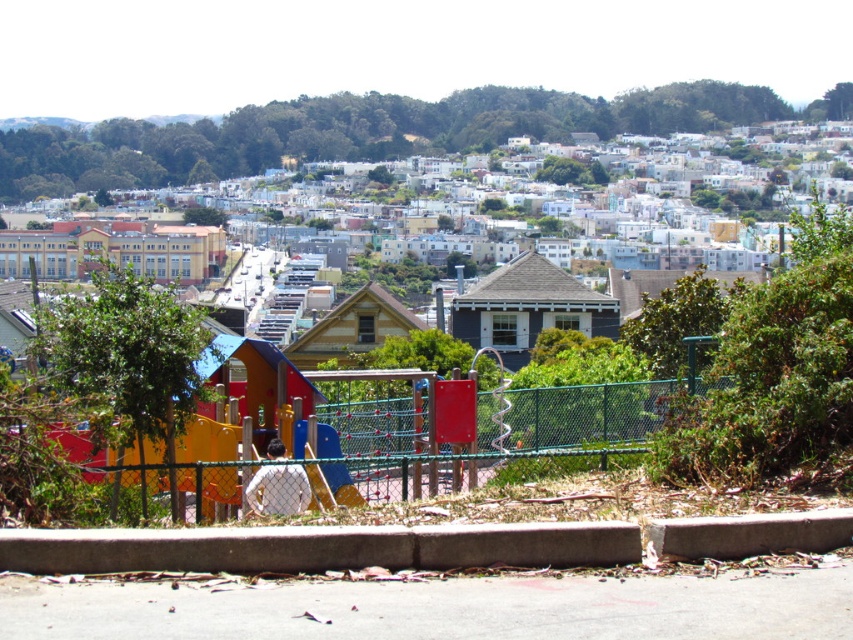
Question: Is green grassy hillside at upper center to the right of green chain-link fence at center from the viewer's perspective?

Choices:
 (A) yes
 (B) no

Answer: (A)

Question: Among these points, which one is farthest from the camera?

Choices:
 (A) (543, 116)
 (B) (543, 369)

Answer: (A)

Question: Which object appears closest to the camera in this image?

Choices:
 (A) green grassy hillside at upper center
 (B) green chain-link fence at center

Answer: (B)

Question: Is green grassy hillside at upper center to the left of green chain-link fence at center from the viewer's perspective?

Choices:
 (A) no
 (B) yes

Answer: (A)

Question: Does green grassy hillside at upper center appear under green chain-link fence at center?

Choices:
 (A) no
 (B) yes

Answer: (A)